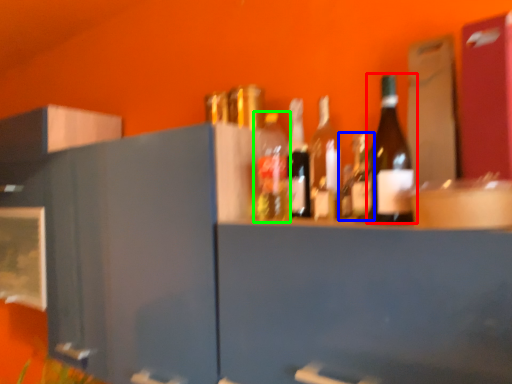
Question: Considering the real-world distances, which object is closest to bottle (highlighted by a red box)? bottle (highlighted by a blue box) or bottle (highlighted by a green box).

Choices:
 (A) bottle
 (B) bottle

Answer: (A)